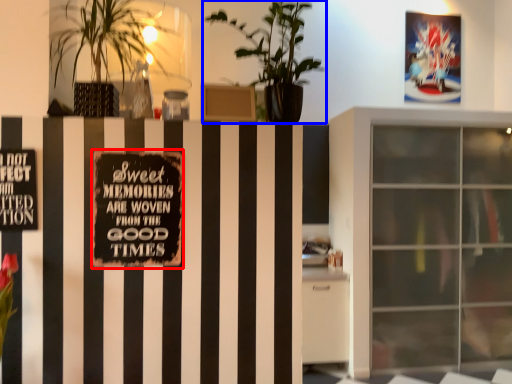
Question: Which point is closer to the camera, bulletin board (highlighted by a red box) or houseplant (highlighted by a blue box)?

Choices:
 (A) bulletin board
 (B) houseplant

Answer: (B)